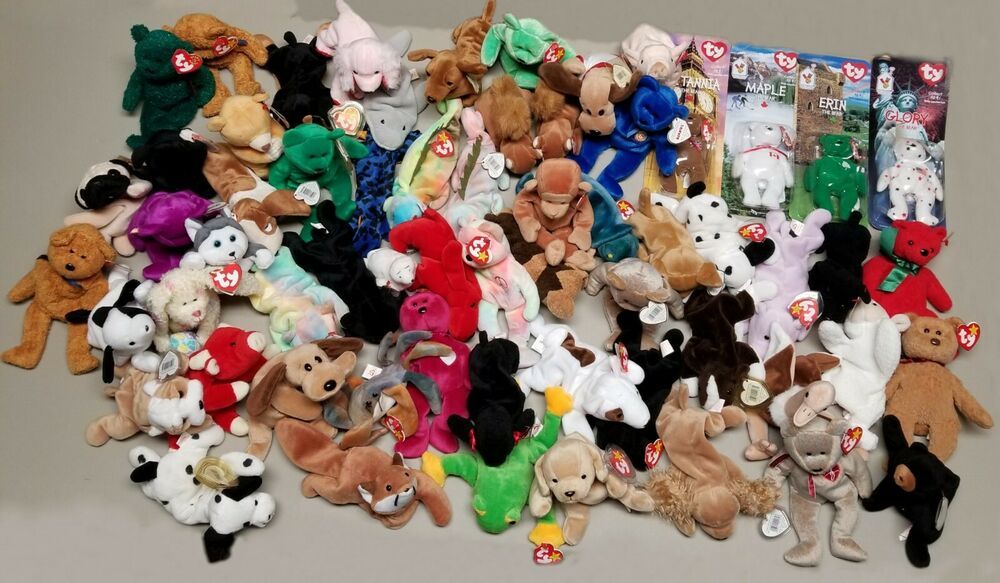
Find the location of a particular element. boxes is located at coordinates pos(699,80), pos(742,76), pos(812,83), pos(886,104).